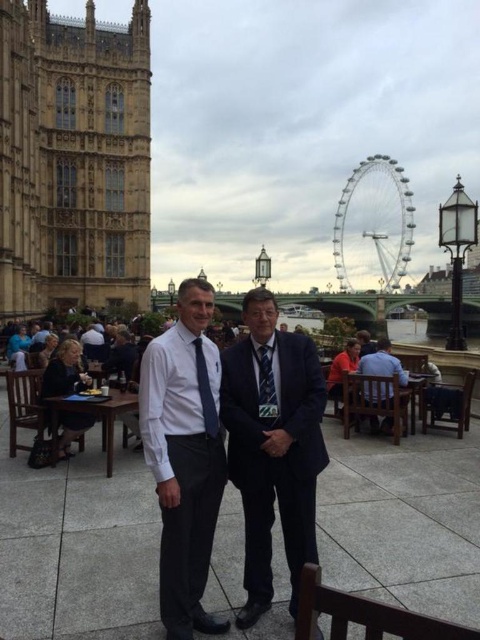
Is point (206, 509) less distant than point (274, 406)?

That is True.

Which is more to the right, white shirt at center or patterned silk tie at center?

patterned silk tie at center

Who is more distant from viewer, (159, 449) or (263, 388)?

The point (263, 388) is more distant.

Identify the location of white shirt at center. The width and height of the screenshot is (480, 640). (184, 456).

Who is shorter, blue shirt at lower right or blue silk tie at center?

blue silk tie at center is shorter.

Is blue shirt at lower right smaller than blue silk tie at center?

No, blue shirt at lower right is not smaller than blue silk tie at center.

Identify the location of blue shirt at lower right. The image size is (480, 640). (383, 364).

At what (x,y) coordinates should I click in order to perform the action: click on blue shirt at lower right. Please return your answer as a coordinate pair (x, y). This screenshot has height=640, width=480. Looking at the image, I should click on (383, 364).

Does dark blue suit at center appear over blue shirt at lower right?

Actually, dark blue suit at center is below blue shirt at lower right.

Between point (292, 484) and point (392, 364), which one is positioned behind?

The point (392, 364) is behind.

Locate an element on the screen. dark blue suit at center is located at coordinates (x=273, y=449).